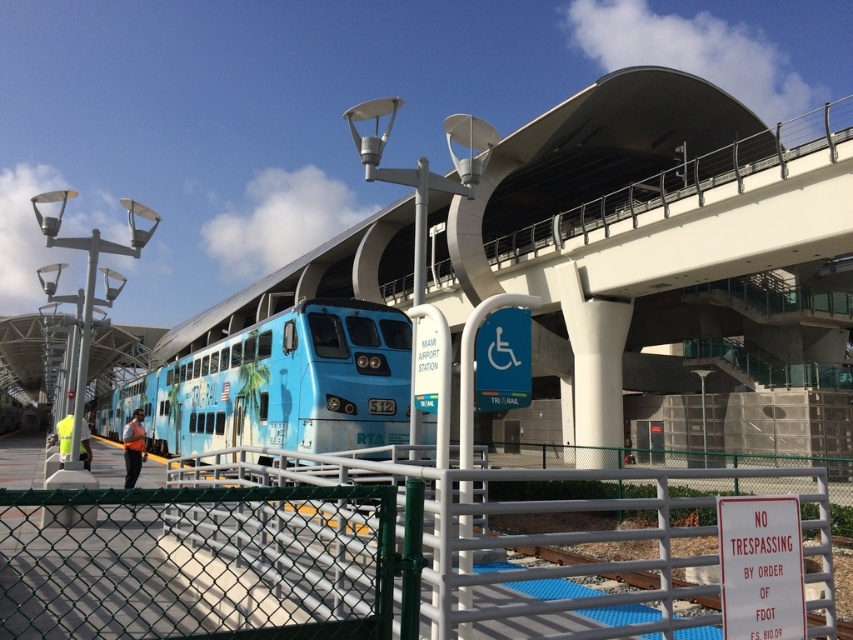
You are standing at the train station and want to take a photo of the train labeled 512. The train is located at a point with coordinates point (172, 406). If your camera has a maximum focus range of 20 meters, will you be able to focus on the train?

The distance of point (172, 406) from the camera is 21.34 meters, which exceeds the camera maximum focus range of 20 meters. Therefore, the camera cannot focus on the train labeled 512.